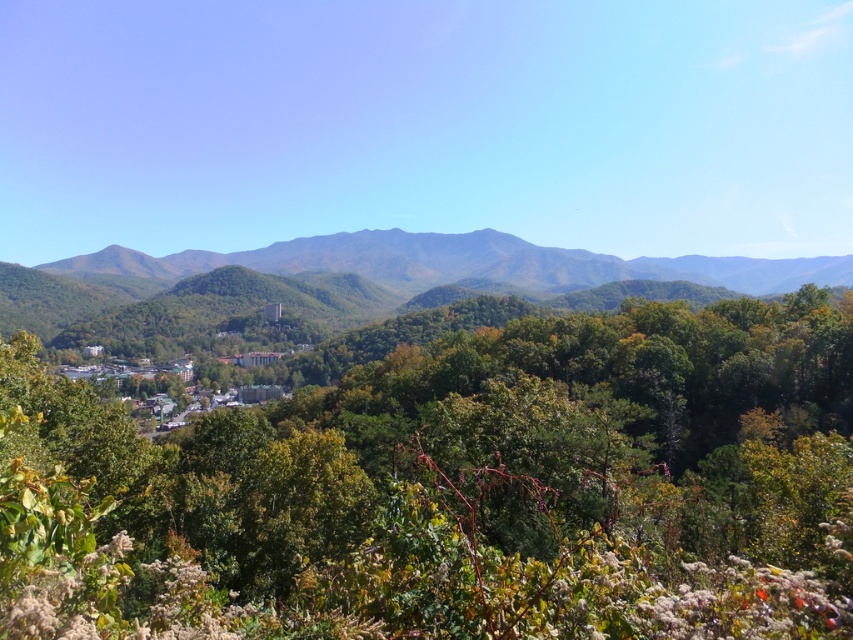
You are standing in the mountainous landscape and notice a green leafy tree at center and a green leafy forest at center. Which one is taller?

The green leafy tree at center is not as tall as the green leafy forest at center, so the green leafy forest at center is taller.

You are an environmental scientist assessing the biodiversity of this mountainous area. You observe the green leafy tree at center and the green leafy forest at center. Which of these two has a smaller width?

The green leafy tree at center has a lesser width compared to the green leafy forest at center.